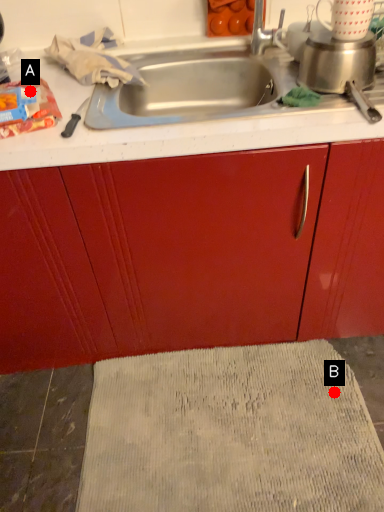
Question: Two points are circled on the image, labeled by A and B beside each circle. Which point is closer to the camera?

Choices:
 (A) A is closer
 (B) B is closer

Answer: (A)